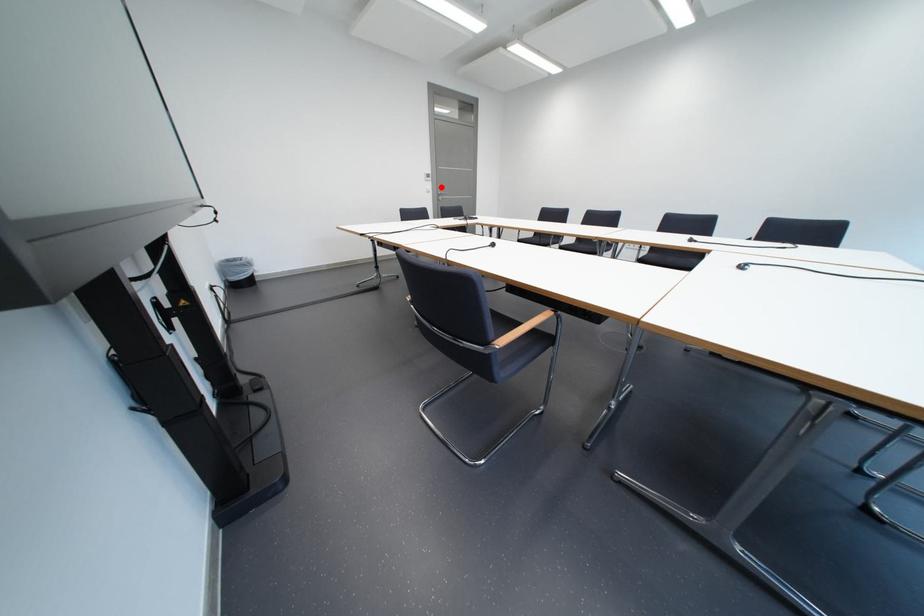
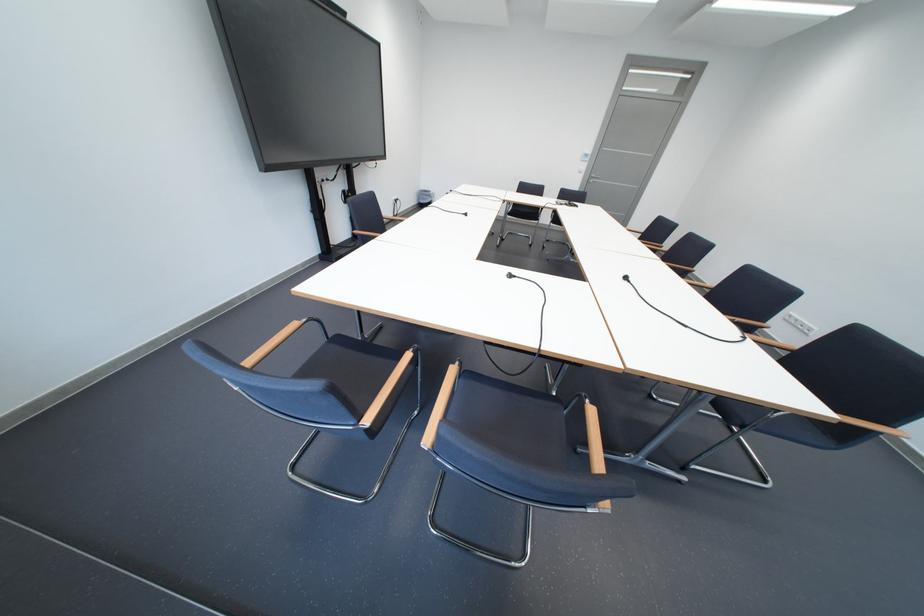
Locate, in the second image, the point that corresponds to the highlighted location in the first image.

(596, 168)